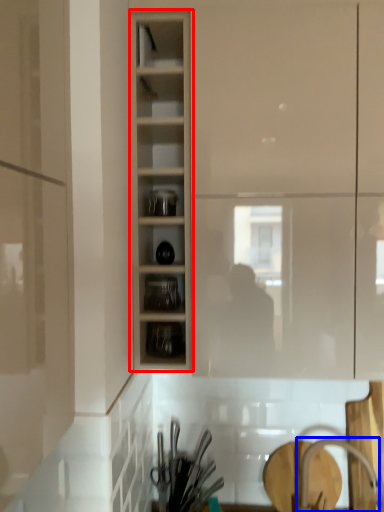
Question: Which object is further to the camera taking this photo, cabinetry (highlighted by a red box) or faucet (highlighted by a blue box)?

Choices:
 (A) cabinetry
 (B) faucet

Answer: (B)